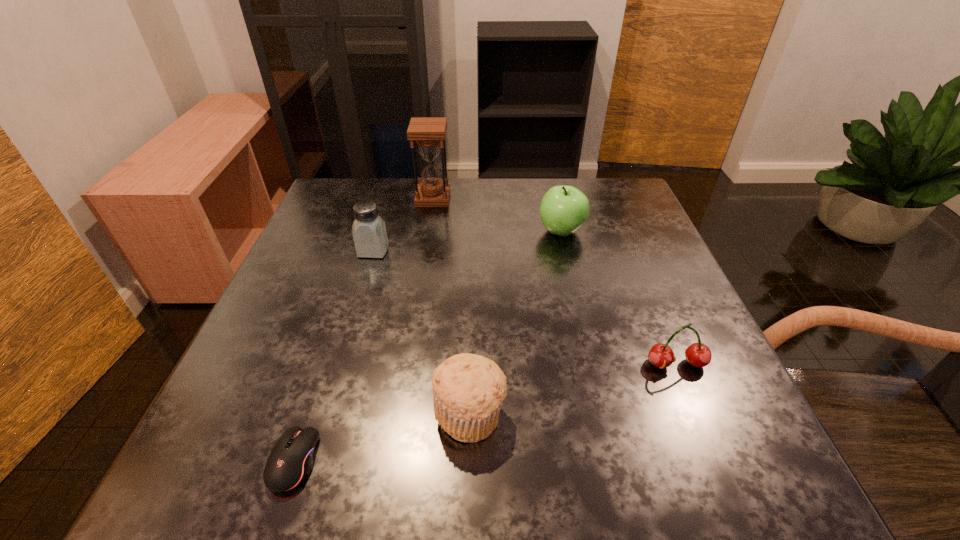
Where is `apple positioned at the right edge`? apple positioned at the right edge is located at coordinates (564, 209).

This screenshot has width=960, height=540. Identify the location of cherry situated at the right edge. (661, 355).

Where is `object that is at the near left corner`? The width and height of the screenshot is (960, 540). object that is at the near left corner is located at coordinates (290, 462).

You are a GUI agent. You are given a task and a screenshot of the screen. Output one action in this format:
    pyautogui.click(x=<x>, y=<y>)
    Task: Click on the object present at the far right corner
    The width and height of the screenshot is (960, 540).
    Given the screenshot: What is the action you would take?
    pyautogui.click(x=564, y=209)

Find the location of a particular element. The height and width of the screenshot is (540, 960). free spot at the far edge of the desktop is located at coordinates (470, 185).

Identify the location of vacant area at the near edge of the desktop. (607, 437).

Find the location of a particular element. The width and height of the screenshot is (960, 540). vacant space at the left edge of the desktop is located at coordinates (350, 228).

Find the location of a particular element. vacant space at the right edge of the desktop is located at coordinates (654, 229).

The height and width of the screenshot is (540, 960). In order to click on free space at the near left corner of the desktop in this screenshot , I will do `click(202, 482)`.

You are a GUI agent. You are given a task and a screenshot of the screen. Output one action in this format:
    pyautogui.click(x=<x>, y=<y>)
    Task: Click on the vacant space at the far right corner of the desktop
    This screenshot has width=960, height=540.
    Given the screenshot: What is the action you would take?
    pyautogui.click(x=587, y=188)